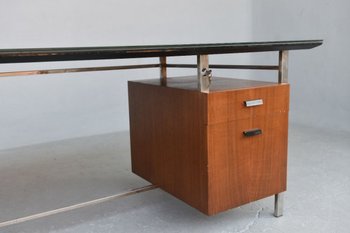
Locate an element on the screen. This screenshot has height=233, width=350. foot rest is located at coordinates (114, 194).